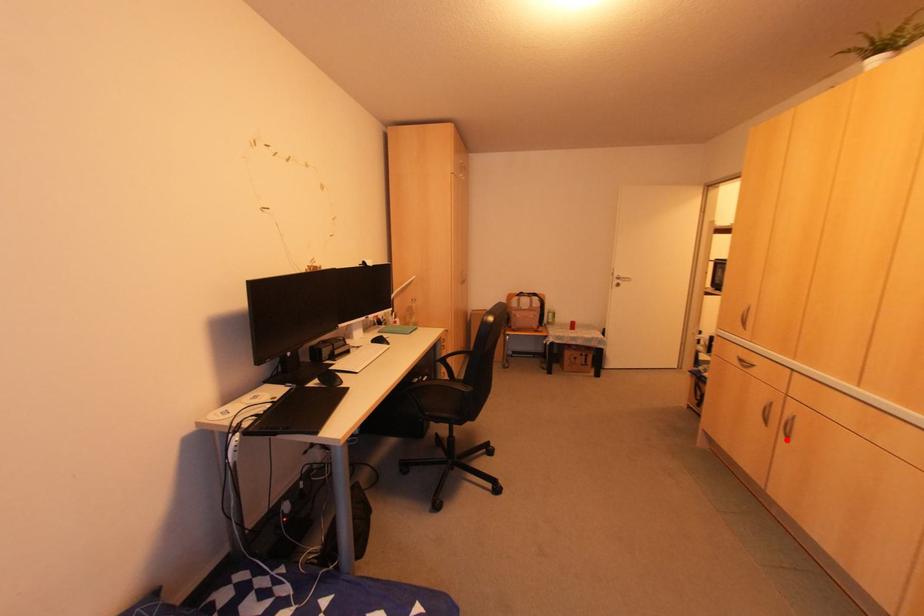
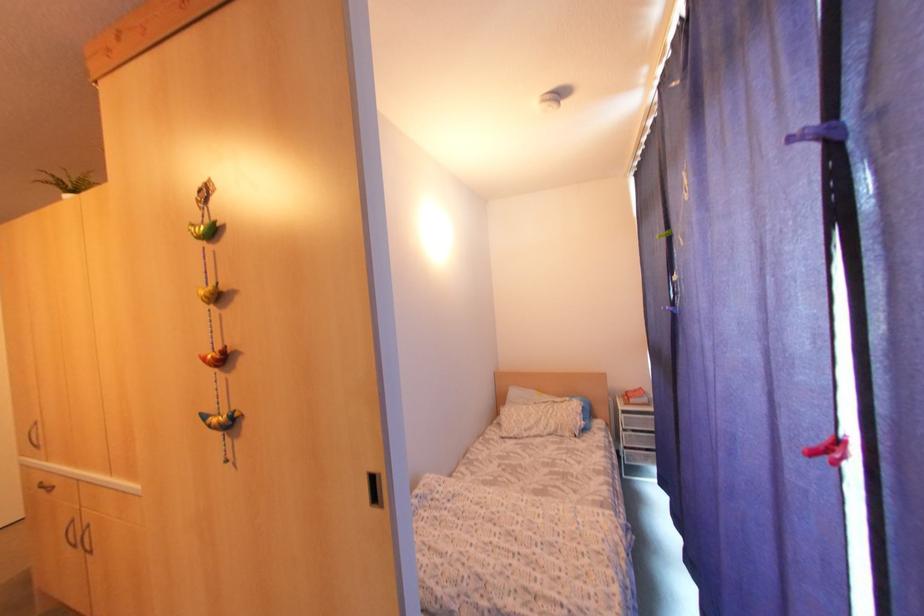
Question: I am providing you with two images of the same scene from different viewpoints. Given a red point in image1, look at the same physical point in image2. Is it:

Choices:
 (A) Closer to the viewpoint
 (B) Farther from the viewpoint

Answer: (A)